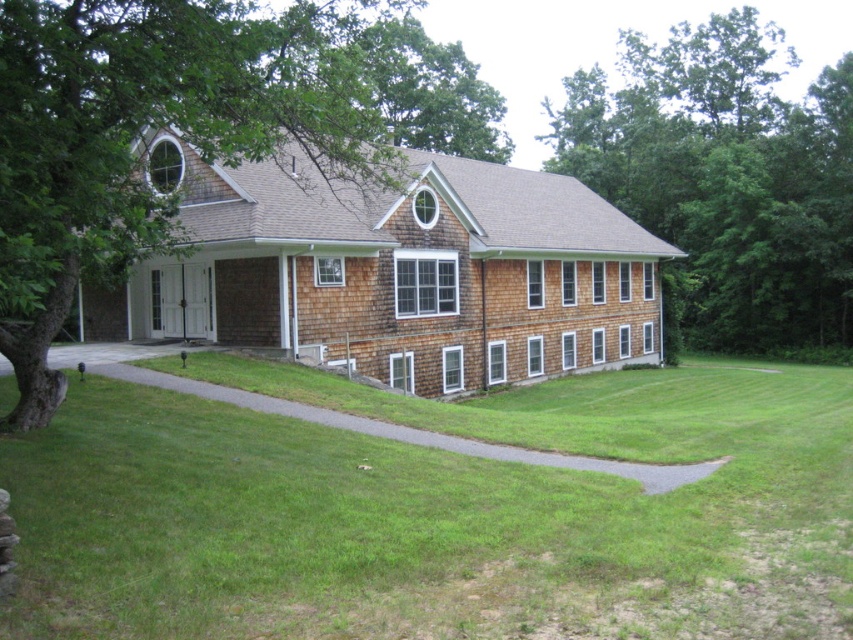
Does green leafy tree at left have a larger size compared to green leafy tree at upper right?

No, green leafy tree at left is not bigger than green leafy tree at upper right.

Which is in front, point (114, 61) or point (631, 61)?

Point (114, 61)

Identify the location of green leafy tree at left. (146, 132).

Between green grass at lower center and green leafy tree at left, which one is positioned higher?

green leafy tree at left

Can you confirm if green grass at lower center is positioned to the left of green leafy tree at left?

Incorrect, green grass at lower center is not on the left side of green leafy tree at left.

Does point (122, 392) come farther from viewer compared to point (38, 250)?

Yes, it is.

The height and width of the screenshot is (640, 853). Identify the location of green grass at lower center. (440, 516).

Is point (54, 552) less distant than point (833, 339)?

Yes.

Consider the image. Which is more to the right, green grass at lower center or green leafy tree at upper right?

Positioned to the right is green leafy tree at upper right.

Between point (799, 490) and point (567, 168), which one is positioned in front?

Point (799, 490) is in front.

In order to click on green grass at lower center in this screenshot , I will do `click(440, 516)`.